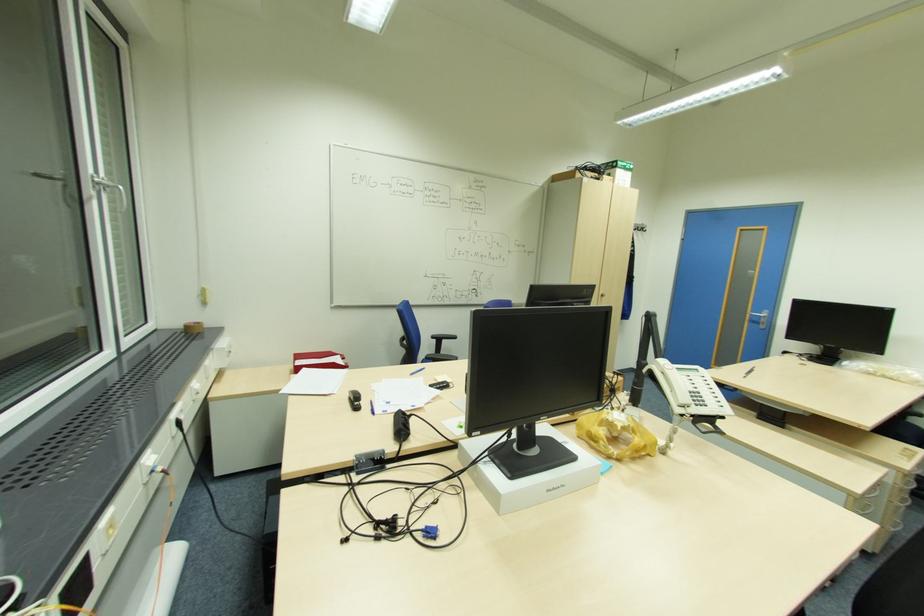
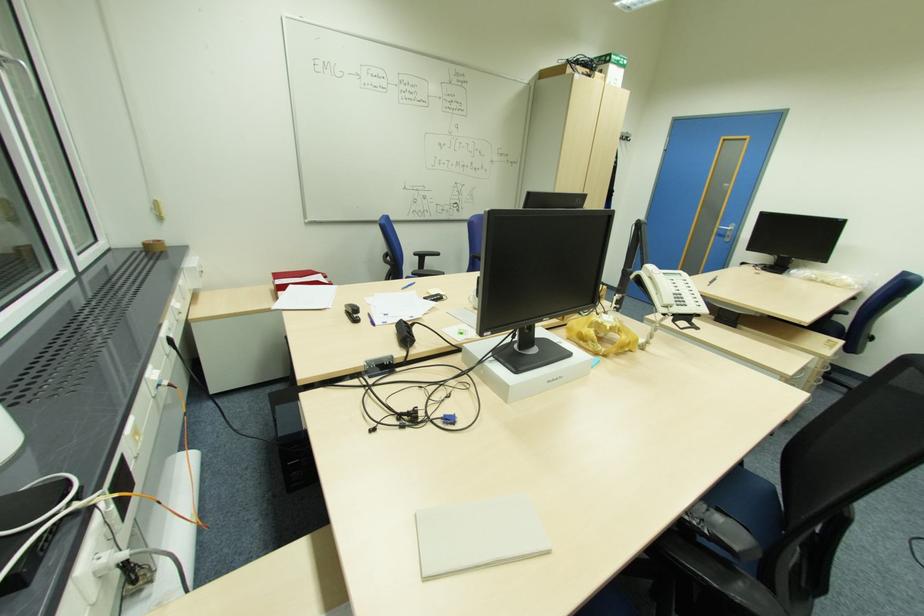
The point at (687, 406) is marked in the first image. Where is the corresponding point in the second image?

(670, 306)